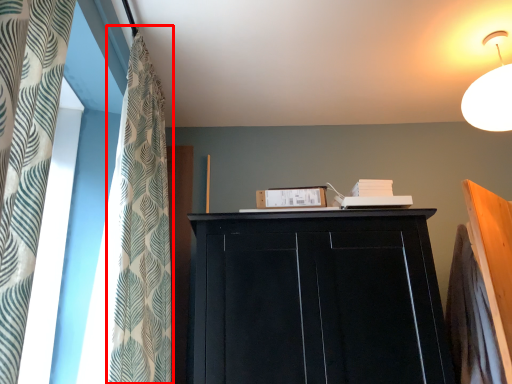
Question: From the image's perspective, where is shower curtain (annotated by the red box) located relative to cupboard?

Choices:
 (A) below
 (B) above

Answer: (B)